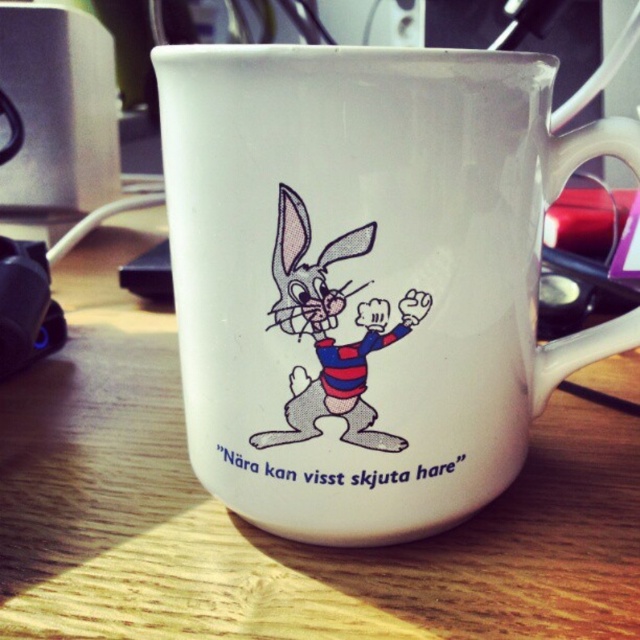
Question: Is white ceramic mug at center positioned behind cartoon rabbit at center?

Choices:
 (A) yes
 (B) no

Answer: (B)

Question: Does wooden table at center have a greater width compared to cartoon rabbit at center?

Choices:
 (A) no
 (B) yes

Answer: (B)

Question: Considering the real-world distances, which object is closest to the white ceramic mug at center?

Choices:
 (A) cartoon rabbit at center
 (B) wooden table at center

Answer: (A)

Question: Among these objects, which one is farthest from the camera?

Choices:
 (A) cartoon rabbit at center
 (B) wooden table at center
 (C) white ceramic mug at center

Answer: (B)

Question: Which of these objects is positioned farthest from the wooden table at center?

Choices:
 (A) cartoon rabbit at center
 (B) white ceramic mug at center

Answer: (A)

Question: Is wooden table at center thinner than cartoon rabbit at center?

Choices:
 (A) no
 (B) yes

Answer: (A)